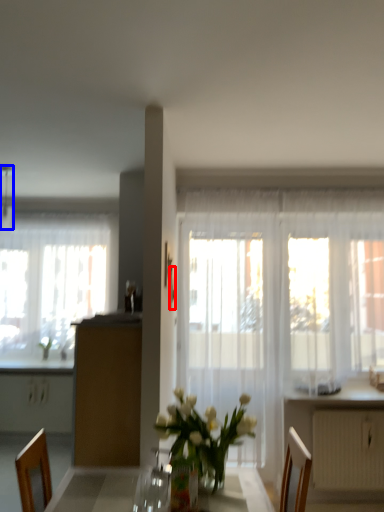
Question: Among these objects, which one is nearest to the camera, picture frame (highlighted by a red box) or lamp (highlighted by a blue box)?

Choices:
 (A) picture frame
 (B) lamp

Answer: (A)